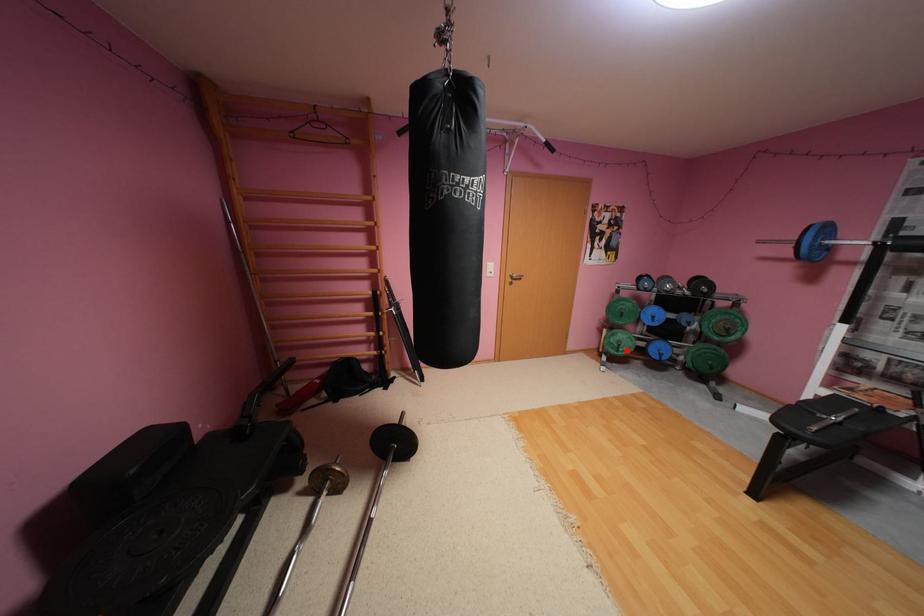
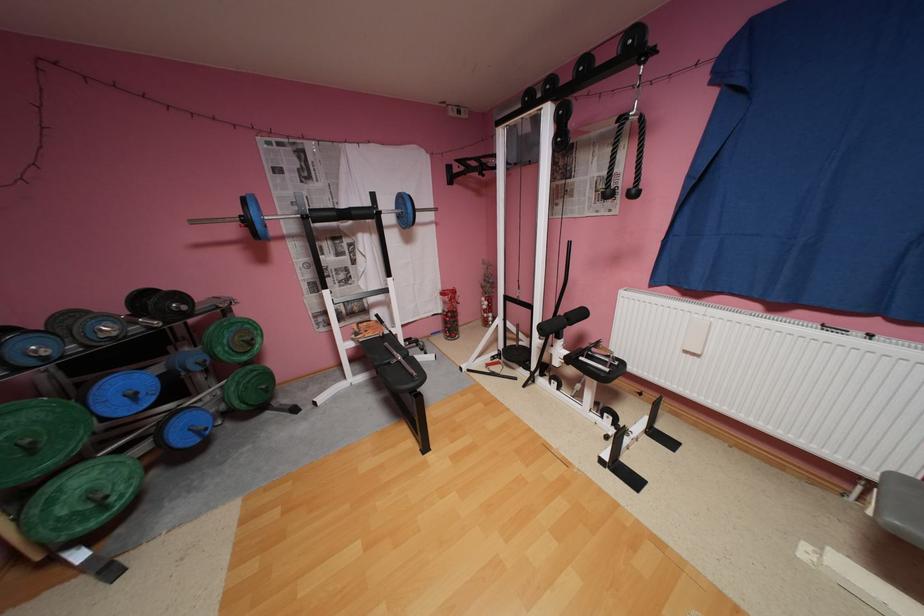
In the second image, find the point that corresponds to the highlighted location in the first image.

(116, 508)